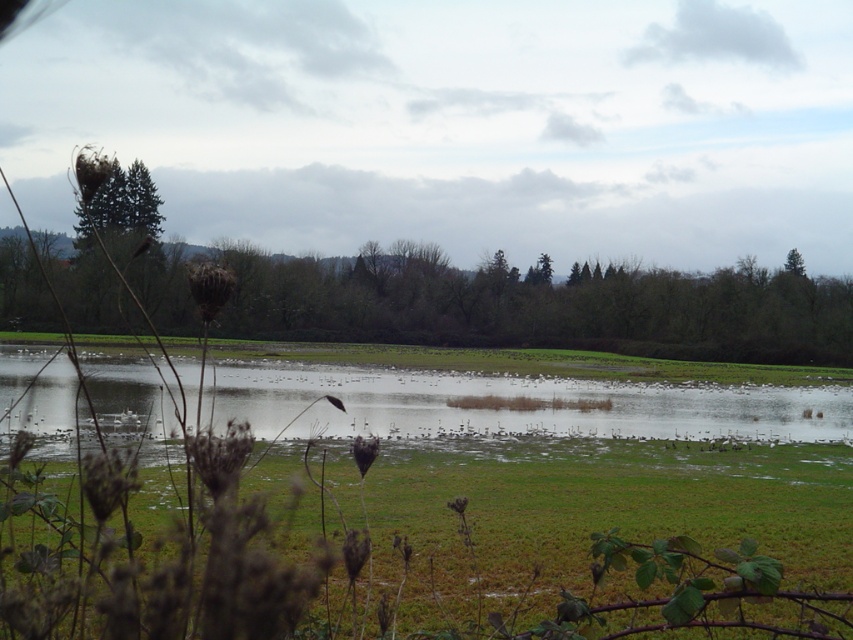
Can you confirm if green leafy tree at left is positioned to the right of green grassy lake at center?

In fact, green leafy tree at left is to the left of green grassy lake at center.

Does green leafy tree at left have a greater height compared to green grassy lake at center?

Yes, green leafy tree at left is taller than green grassy lake at center.

Locate an element on the screen. green leafy tree at left is located at coordinates (541, 305).

Identify the location of green grass at center. This screenshot has width=853, height=640. (402, 556).

Where is `green grass at center`? green grass at center is located at coordinates (402, 556).

This screenshot has width=853, height=640. What are the coordinates of `green grass at center` in the screenshot? It's located at (402, 556).

Who is positioned more to the left, green leafy tree at left or green matte tree at upper left?

From the viewer's perspective, green matte tree at upper left appears more on the left side.

Does green leafy tree at left appear on the right side of green matte tree at upper left?

Yes, green leafy tree at left is to the right of green matte tree at upper left.

Is point (172, 266) more distant than point (94, 216)?

No, (172, 266) is in front of (94, 216).

The width and height of the screenshot is (853, 640). I want to click on green leafy tree at left, so click(x=541, y=305).